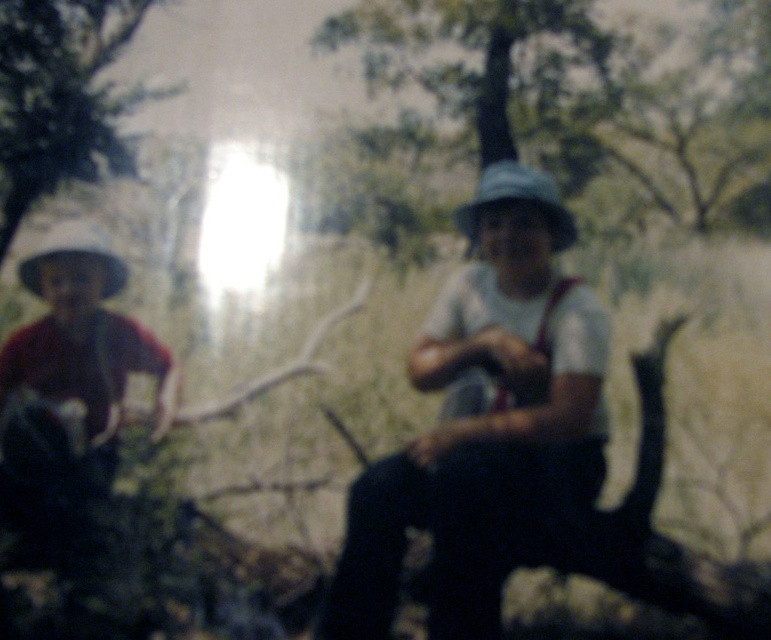
Is point (406, 458) farther from viewer compared to point (110, 172)?

No, it is not.

The image size is (771, 640). Describe the element at coordinates (483, 406) in the screenshot. I see `matte white hat at center` at that location.

This screenshot has height=640, width=771. I want to click on matte white hat at center, so [x=483, y=406].